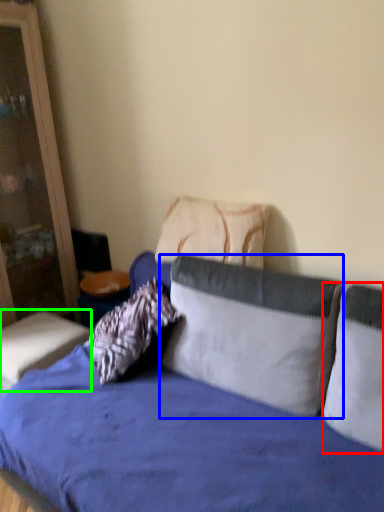
Question: Based on their relative distances, which object is farther from pillow (highlighted by a red box)? Choose from pillow (highlighted by a blue box) and table (highlighted by a green box).

Choices:
 (A) pillow
 (B) table

Answer: (B)